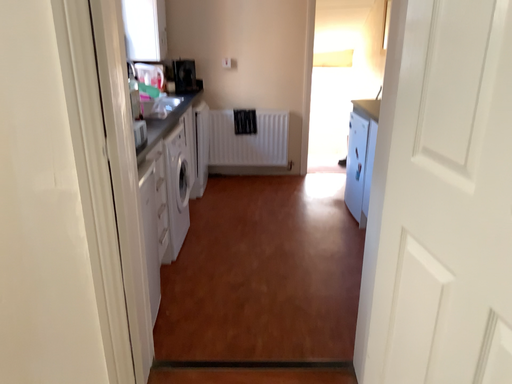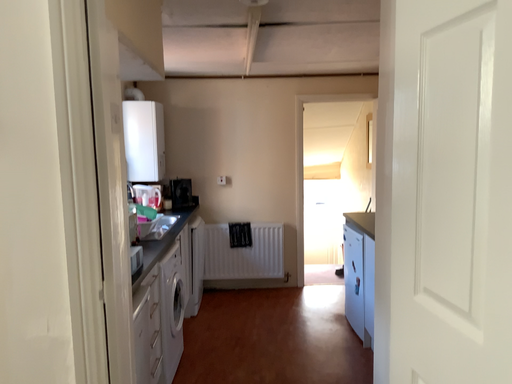
Question: How did the camera likely rotate when shooting the video?

Choices:
 (A) rotated upward
 (B) rotated downward

Answer: (A)